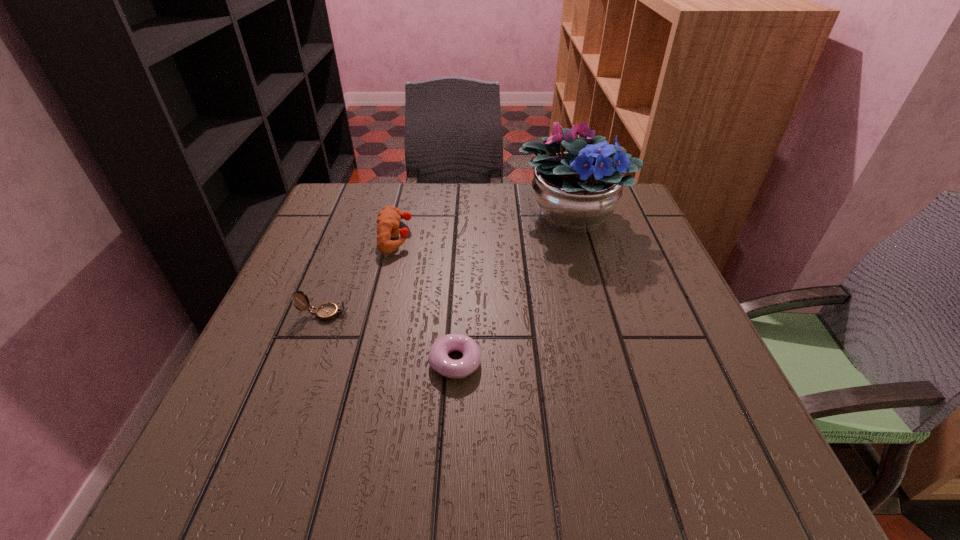
Image resolution: width=960 pixels, height=540 pixels. Find the location of `vacant region that satisfies the following two spatial constraints: 1. with the gloves of the third object from left to right facing forward; 2. on the right side of the third object from right to left`. vacant region that satisfies the following two spatial constraints: 1. with the gloves of the third object from left to right facing forward; 2. on the right side of the third object from right to left is located at coordinates (366, 362).